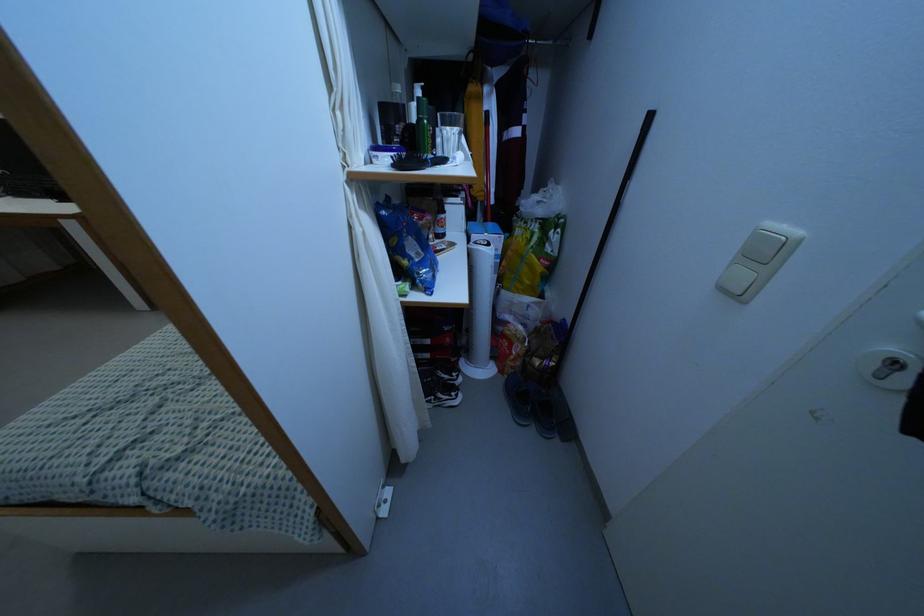
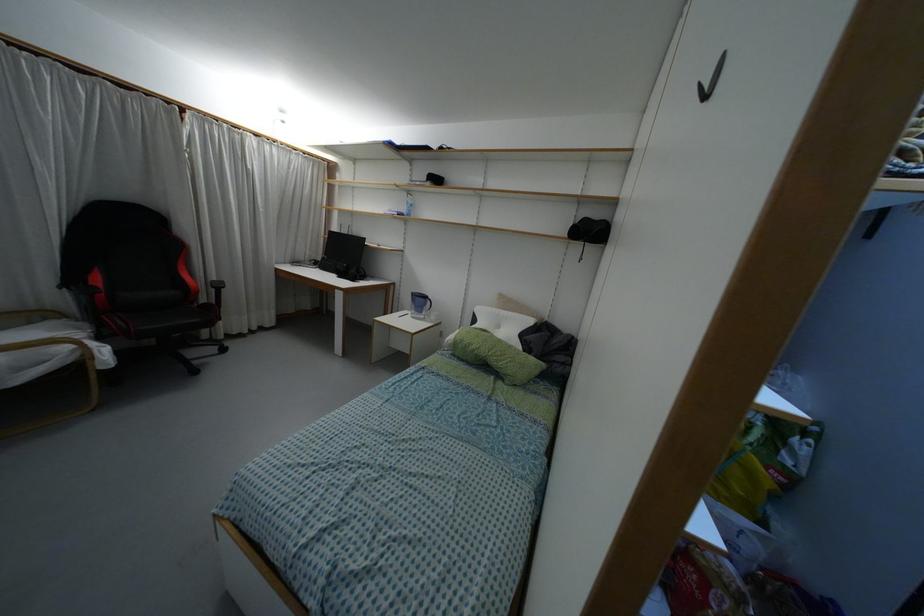
First-person continuous shooting, in which direction is the camera rotating?

The camera rotated toward left-up.